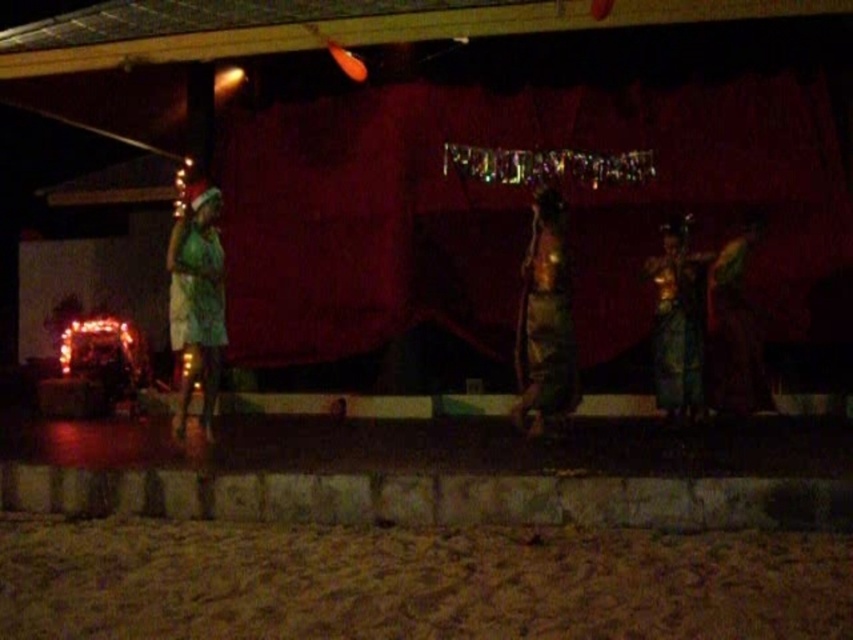
Question: Which is farther from the green silk dress at center?

Choices:
 (A) metallic gold statue at center
 (B) green fabric dress at right
 (C) green fabric dress at left

Answer: (C)

Question: Which object appears closest to the camera in this image?

Choices:
 (A) green fabric dress at left
 (B) green silk dress at center
 (C) metallic gold statue at center
 (D) green fabric dress at right

Answer: (C)

Question: Which point is closer to the camera taking this photo?

Choices:
 (A) (753, 396)
 (B) (550, 355)
 (C) (204, 259)
 (D) (672, 292)

Answer: (B)

Question: Is green silk dress at center bigger than green fabric dress at right?

Choices:
 (A) no
 (B) yes

Answer: (B)

Question: Considering the relative positions of green fabric dress at left and green silk dress at center in the image provided, where is green fabric dress at left located with respect to green silk dress at center?

Choices:
 (A) above
 (B) below

Answer: (B)

Question: Can you confirm if metallic gold statue at center is positioned below green fabric dress at left?

Choices:
 (A) no
 (B) yes

Answer: (A)